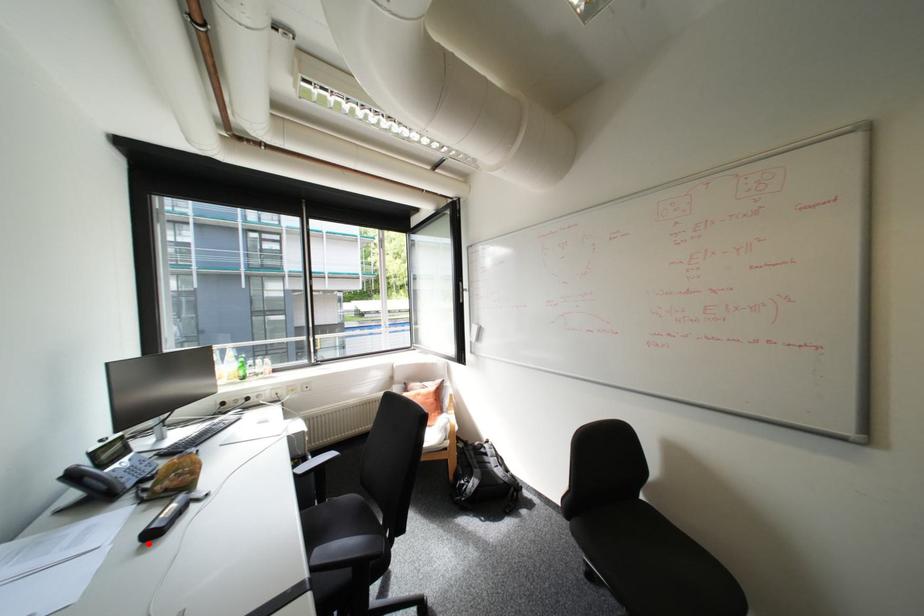
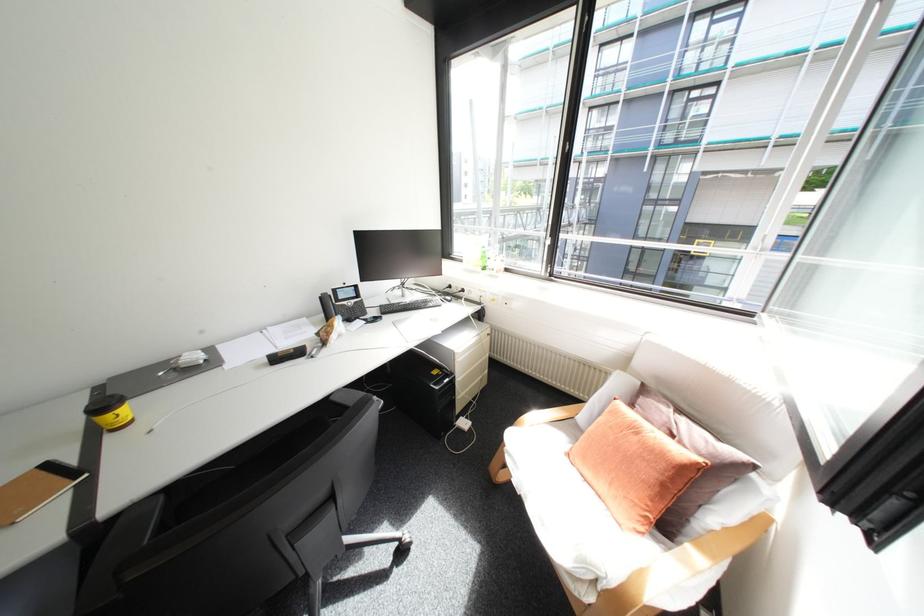
Locate, in the second image, the point that corresponds to the highlighted location in the first image.

(275, 361)